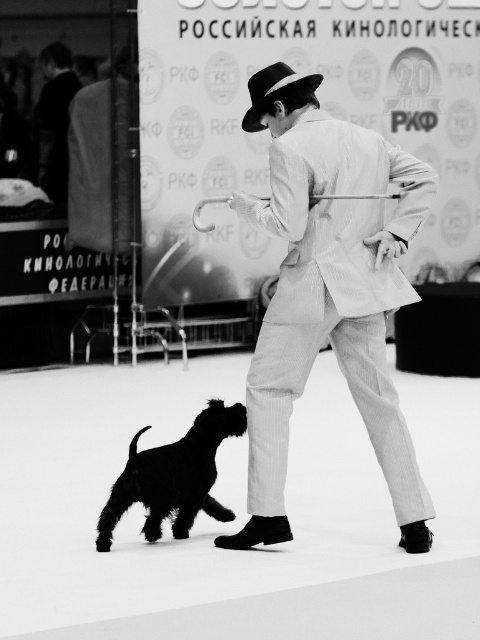
Describe the element at coordinates (327, 292) in the screenshot. The width and height of the screenshot is (480, 640). I see `white pinstripe suit at center` at that location.

Find the location of a particular element. This screenshot has height=640, width=480. white pinstripe suit at center is located at coordinates (327, 292).

Is point (406, 246) less distant than point (183, 529)?

Yes, point (406, 246) is in front of point (183, 529).

Where is `white pinstripe suit at center`? Image resolution: width=480 pixels, height=640 pixels. white pinstripe suit at center is located at coordinates (327, 292).

From the picture: Who is higher up, black fur dog at lower left or black felt fedora at center?

black felt fedora at center is higher up.

Between black fur dog at lower left and black felt fedora at center, which one has less height?

With less height is black felt fedora at center.

At what (x,y) coordinates should I click in order to perform the action: click on black fur dog at lower left. Please return your answer as a coordinate pair (x, y). Looking at the image, I should click on (173, 476).

The width and height of the screenshot is (480, 640). Find the location of `black fur dog at lower left`. black fur dog at lower left is located at coordinates (173, 476).

Which is more to the right, white pinstripe suit at center or black felt fedora at center?

Positioned to the right is white pinstripe suit at center.

Where is `white pinstripe suit at center`? The image size is (480, 640). white pinstripe suit at center is located at coordinates pyautogui.click(x=327, y=292).

From the picture: Who is more distant from viewer, (343, 241) or (295, 81)?

Point (343, 241)

This screenshot has width=480, height=640. I want to click on white pinstripe suit at center, so click(x=327, y=292).